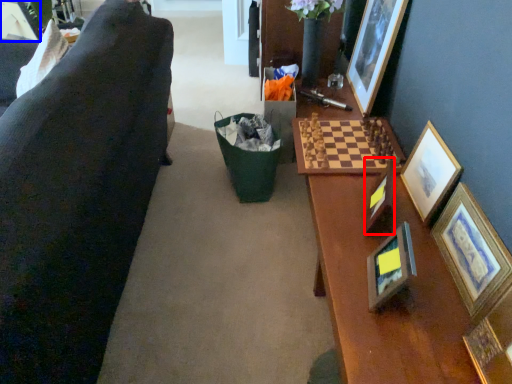
Question: Which of the following is the closest to the observer, picture frame (highlighted by a red box) or picture frame (highlighted by a blue box)?

Choices:
 (A) picture frame
 (B) picture frame

Answer: (A)